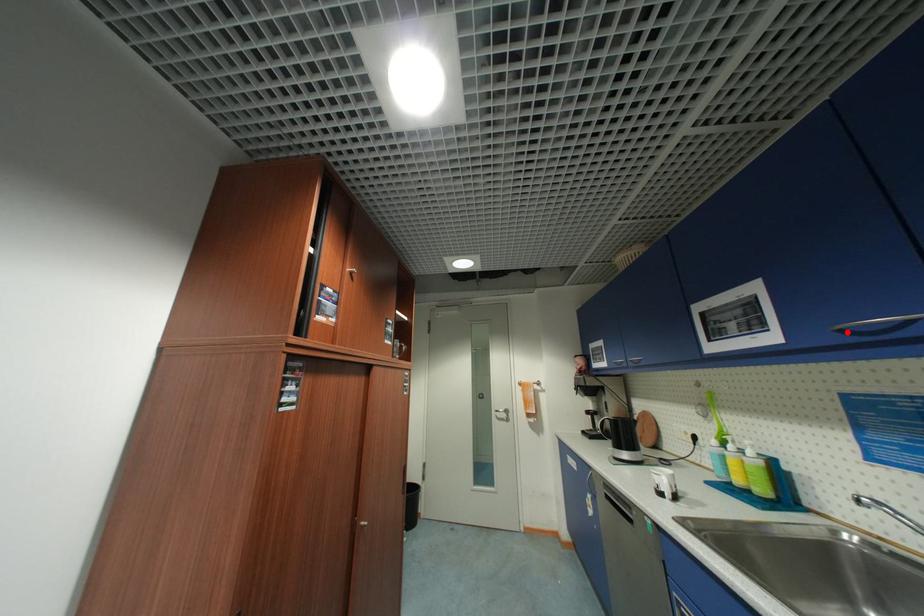
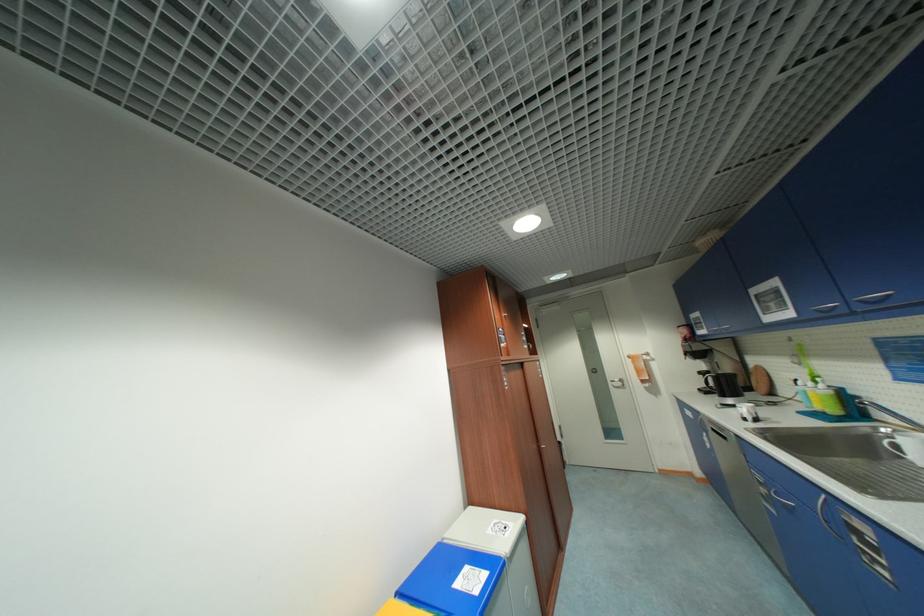
Find the pixel in the second image that matches the highlighted location in the first image.

(822, 312)